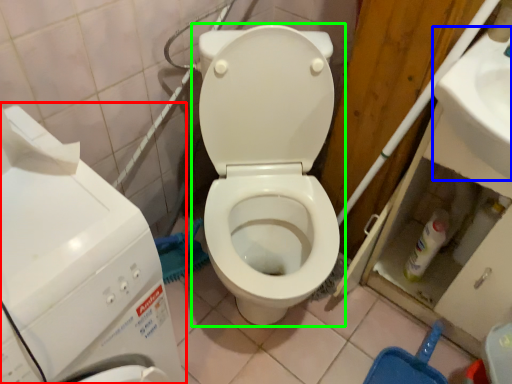
Question: Which is nearer to the washing machine (highlighted by a red box)? sink (highlighted by a blue box) or toilet (highlighted by a green box).

Choices:
 (A) sink
 (B) toilet

Answer: (B)